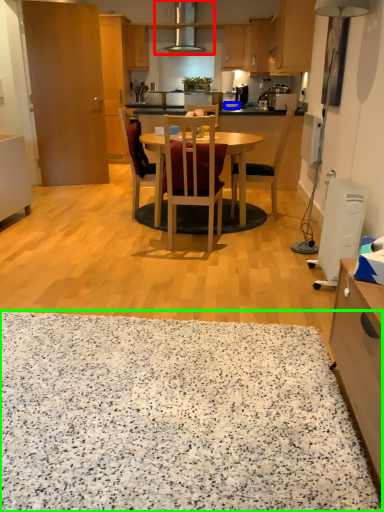
Question: Estimate the real-world distances between objects in this image. Which object is farther from oven (highlighted by a red box), plate (highlighted by a blue box) or granite (highlighted by a green box)?

Choices:
 (A) plate
 (B) granite

Answer: (B)